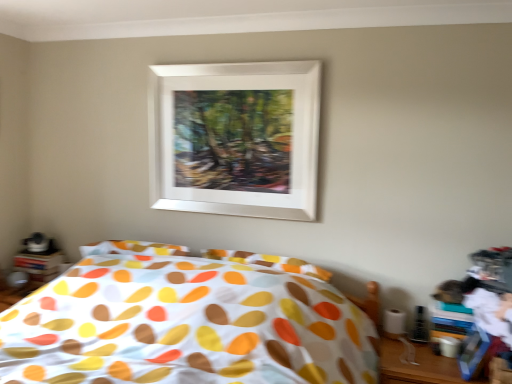
Identify the location of free point above white matte picture frame at upper center (from a real-world perspective). (233, 64).